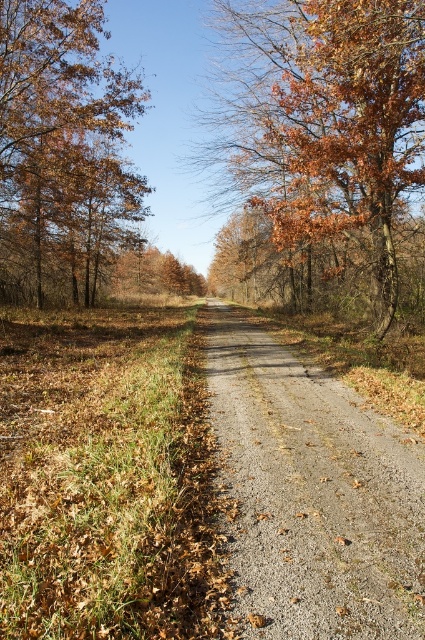
Does gray gravel road at center have a lesser height compared to brown textured leaves at center?

Correct, gray gravel road at center is not as tall as brown textured leaves at center.

Is gray gravel road at center thinner than brown textured leaves at center?

Yes.

Find the location of a particular element. gray gravel road at center is located at coordinates click(314, 493).

Which of these two, gray gravel road at center or brown matte tree at upper left, stands taller?

With more height is brown matte tree at upper left.

Is gray gravel road at center smaller than brown matte tree at upper left?

Yes, gray gravel road at center is smaller than brown matte tree at upper left.

Between point (323, 378) and point (30, 193), which one is positioned in front?

Point (323, 378) is in front.

Where is `gray gravel road at center`? The width and height of the screenshot is (425, 640). gray gravel road at center is located at coordinates (314, 493).

Which is more to the right, brown textured leaves at center or brown matte tree at upper left?

brown textured leaves at center

Is point (340, 45) in front of point (129, 128)?

Yes.

Where is `brown textured leaves at center`? The width and height of the screenshot is (425, 640). brown textured leaves at center is located at coordinates (325, 125).